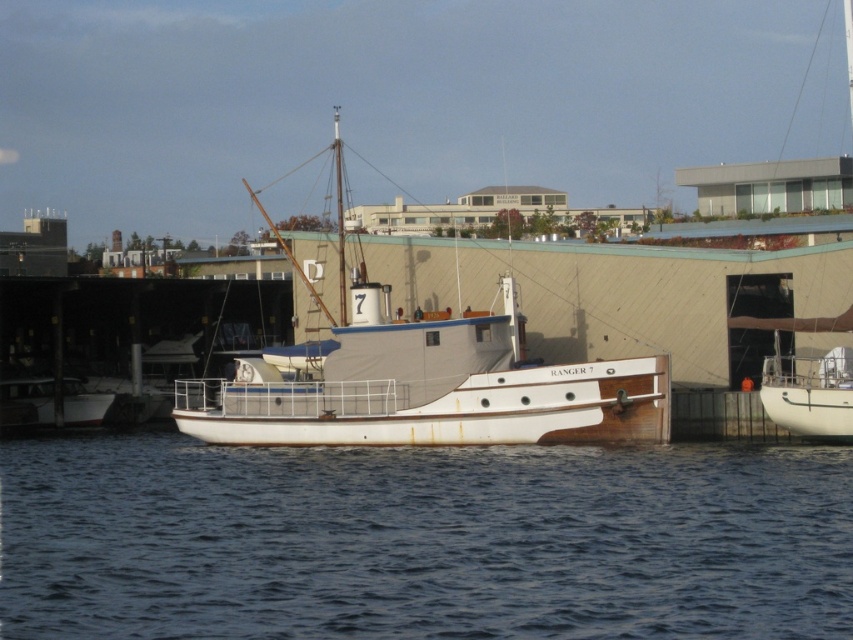
Question: Among these objects, which one is farthest from the camera?

Choices:
 (A) blue water at center
 (B) white wood boat at center
 (C) white matte sailboat at right

Answer: (B)

Question: Among these objects, which one is farthest from the camera?

Choices:
 (A) blue water at center
 (B) white wood boat at center
 (C) white matte sailboat at right
 (D) rusty metal boat at lower left

Answer: (D)

Question: Which object appears farthest from the camera in this image?

Choices:
 (A) white wood boat at center
 (B) blue water at center
 (C) rusty metal boat at lower left

Answer: (C)

Question: Does blue water at center have a lesser width compared to white wood boat at center?

Choices:
 (A) yes
 (B) no

Answer: (A)

Question: Can you confirm if blue water at center is wider than white matte sailboat at right?

Choices:
 (A) no
 (B) yes

Answer: (B)

Question: Does blue water at center appear on the right side of white wood boat at center?

Choices:
 (A) no
 (B) yes

Answer: (B)